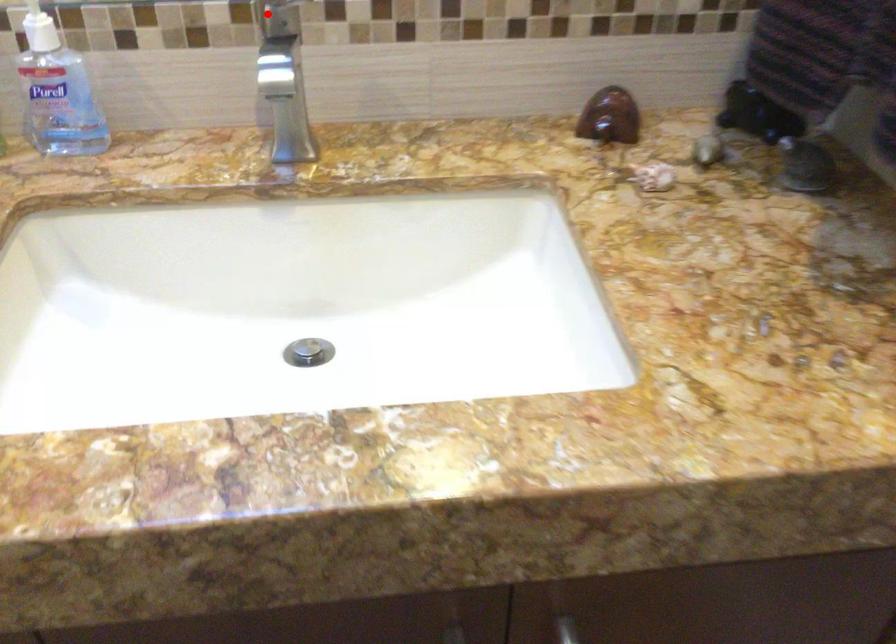
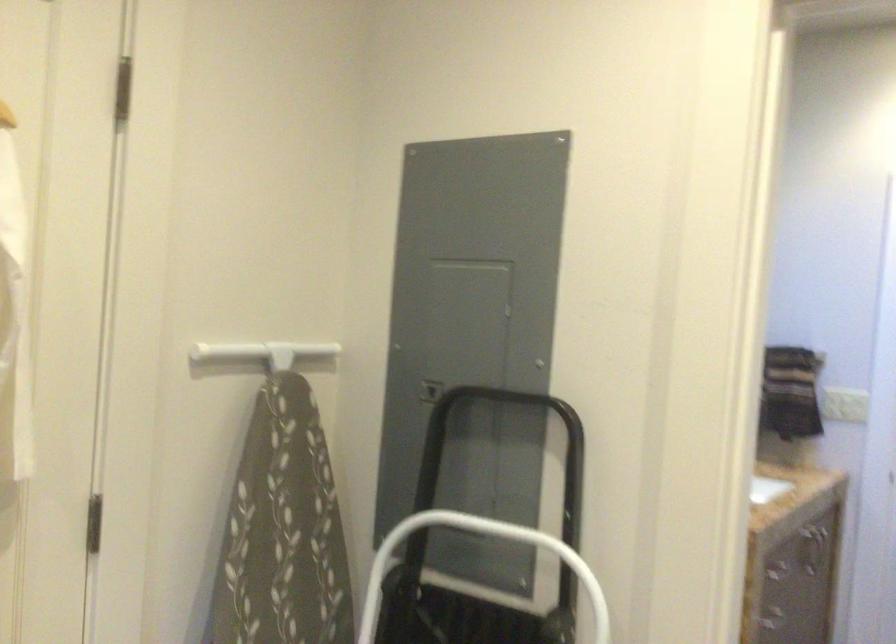
Question: I am providing you with two images of the same scene from different viewpoints. A red point is marked on the first image. Can you still see the location of the red point in image 2?

Choices:
 (A) Yes
 (B) No

Answer: (B)